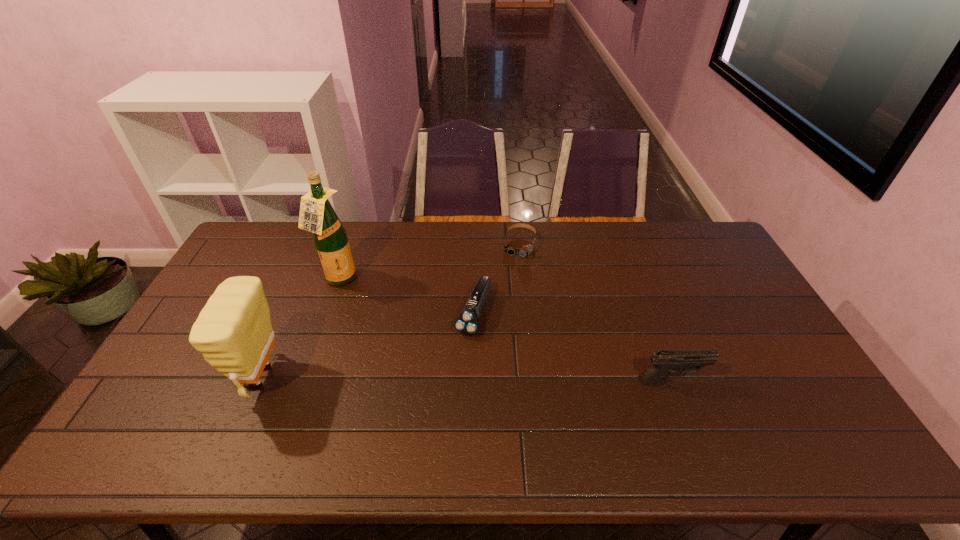
Image resolution: width=960 pixels, height=540 pixels. I want to click on vacant space located 0.100m on the head of the second shortest object, so click(x=457, y=366).

I want to click on object positioned at the far edge, so click(x=525, y=250).

Find the location of a particular element. object that is at the near edge is located at coordinates (233, 331).

Where is `vacant region at the far edge of the desktop`? Image resolution: width=960 pixels, height=540 pixels. vacant region at the far edge of the desktop is located at coordinates (422, 251).

The height and width of the screenshot is (540, 960). What are the coordinates of `vacant space at the near edge of the desktop` in the screenshot? It's located at (720, 408).

The image size is (960, 540). I want to click on free space at the left edge of the desktop, so click(x=192, y=359).

Locate an element on the screen. The height and width of the screenshot is (540, 960). free space at the right edge of the desktop is located at coordinates (783, 377).

Locate an element on the screen. The width and height of the screenshot is (960, 540). vacant space that is in between the second object from right to left and the second shortest object is located at coordinates (496, 278).

Where is `empty space between the shortest object and the pistol`? empty space between the shortest object and the pistol is located at coordinates (595, 313).

Identify the location of vacant area between the shortest object and the third object from left to right. This screenshot has height=540, width=960. (496, 278).